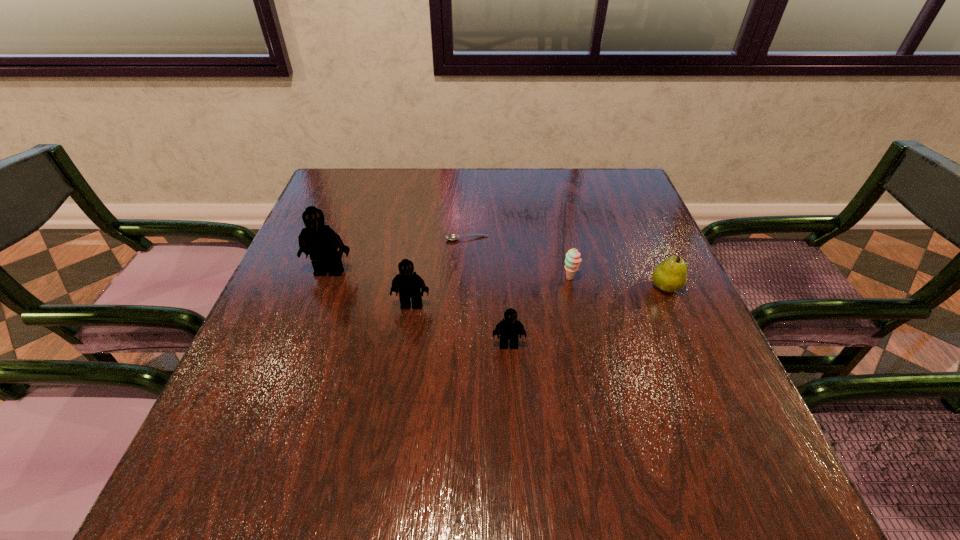
You are a GUI agent. You are given a task and a screenshot of the screen. Output one action in this format:
    pyautogui.click(x=<x>, y=<y>)
    Task: Click on the object that can be found as the fifth closest to the second object from left to right
    This screenshot has height=540, width=960.
    Given the screenshot: What is the action you would take?
    pyautogui.click(x=670, y=275)

Identify the location of Lego that is the second nearest to the shortest Lego. (321, 242).

Choose which Lego is the second nearest neighbor to the third object from left to right. Please provide its 2D coordinates. Your answer should be formatted as a tuple, i.e. [(x, y)], where the tuple contains the x and y coordinates of a point satisfying the conditions above.

[(321, 242)]

Find the location of a particular element. vacant space that satisfies the following two spatial constraints: 1. on the front side of the sherbert; 2. on the right side of the pear is located at coordinates click(x=572, y=287).